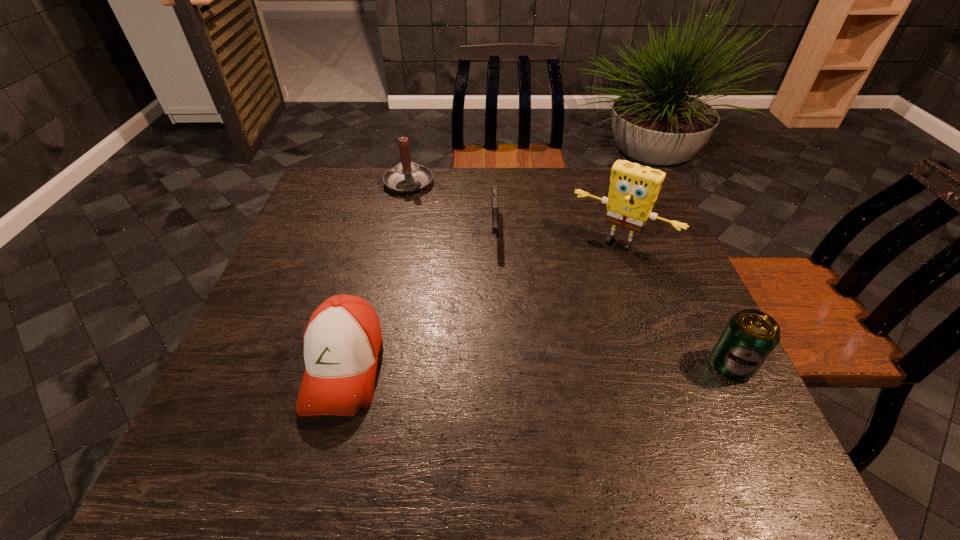
The height and width of the screenshot is (540, 960). Identify the location of beer can at the near edge. (750, 336).

The height and width of the screenshot is (540, 960). Find the location of `object that is at the left edge`. object that is at the left edge is located at coordinates (342, 341).

Where is `beer can at the right edge`? beer can at the right edge is located at coordinates (750, 336).

Find the location of a particular element. sponge that is at the right edge is located at coordinates (633, 191).

Identify the location of object present at the near left corner. (342, 341).

You are a GUI agent. You are given a task and a screenshot of the screen. Output one action in this format:
    pyautogui.click(x=<x>, y=<y>)
    Task: Click on the object located at the near right corner
    The image size is (960, 540).
    Given the screenshot: What is the action you would take?
    pos(750,336)

The width and height of the screenshot is (960, 540). In the image, there is a desktop. Find the location of `vacant space at the far edge`. vacant space at the far edge is located at coordinates [x=451, y=211].

You are a GUI agent. You are given a task and a screenshot of the screen. Output one action in this format:
    pyautogui.click(x=<x>, y=<y>)
    Task: Click on the free space at the near edge
    
    Given the screenshot: What is the action you would take?
    pyautogui.click(x=592, y=396)

You are a GUI agent. You are given a task and a screenshot of the screen. Output one action in this format:
    pyautogui.click(x=<x>, y=<y>)
    Task: Click on the vacant space at the left edge of the desktop
    The width and height of the screenshot is (960, 540).
    Given the screenshot: What is the action you would take?
    pyautogui.click(x=302, y=218)

In the image, there is a desktop. At what (x,y) coordinates should I click in order to perform the action: click on vacant space at the right edge. Please return your answer as a coordinate pair (x, y). Looking at the image, I should click on (702, 338).